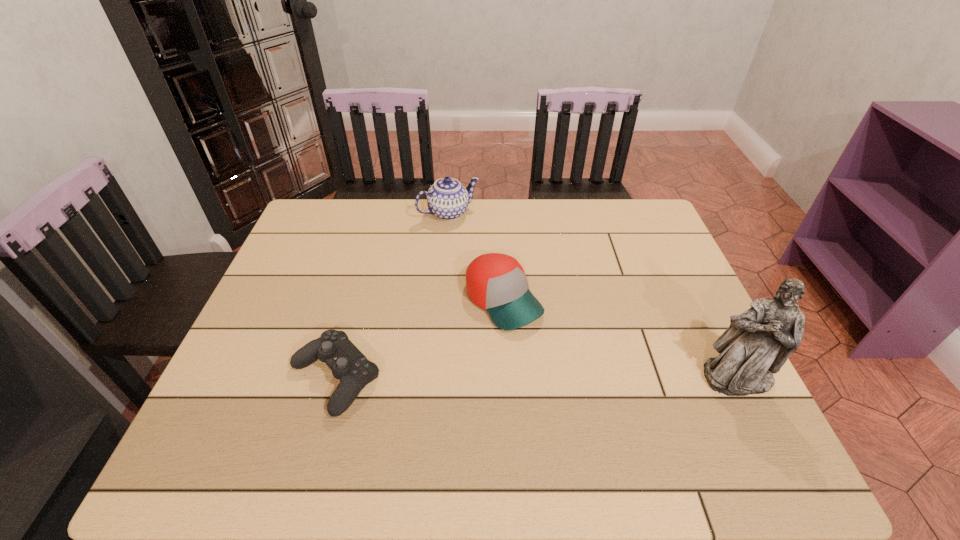
Locate an element on the screen. This screenshot has width=960, height=540. empty space between the second shortest object and the shortest object is located at coordinates (420, 339).

At what (x,y) coordinates should I click in order to perform the action: click on free space between the second shortest object and the control. Please return your answer as a coordinate pair (x, y). The image size is (960, 540). Looking at the image, I should click on (420, 339).

At what (x,y) coordinates should I click in order to perform the action: click on free space that is in between the rightmost object and the chinaware. Please return your answer as a coordinate pair (x, y). Looking at the image, I should click on (593, 295).

You are a GUI agent. You are given a task and a screenshot of the screen. Output one action in this format:
    pyautogui.click(x=<x>, y=<y>)
    Task: Click on the free point between the third nearest object and the tallest object
    
    Given the screenshot: What is the action you would take?
    pyautogui.click(x=620, y=339)

Find the location of a particular element. vacant space in between the control and the third shortest object is located at coordinates (392, 295).

Where is `vacant point located between the baseball cap and the second tallest object`? The width and height of the screenshot is (960, 540). vacant point located between the baseball cap and the second tallest object is located at coordinates (476, 257).

This screenshot has width=960, height=540. Find the location of `free space between the leftmost object and the chinaware`. free space between the leftmost object and the chinaware is located at coordinates (392, 295).

The height and width of the screenshot is (540, 960). In order to click on the second closest object relative to the figurine in this screenshot , I will do `click(348, 364)`.

Locate an element on the screen. This screenshot has height=540, width=960. object that stands as the closest to the shortest object is located at coordinates (495, 282).

Locate an element on the screen. Image resolution: width=960 pixels, height=540 pixels. vacant position in the image that satisfies the following two spatial constraints: 1. on the front side of the third tallest object; 2. on the left side of the farthest object is located at coordinates (441, 300).